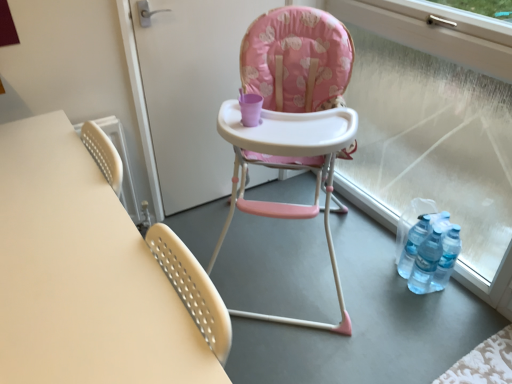
I want to click on vacant space to the right of pink fabric highchair at center, so click(x=408, y=294).